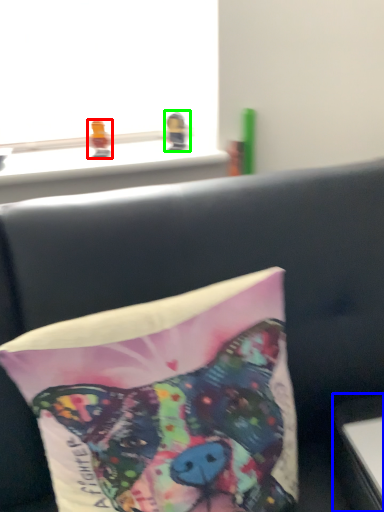
Question: Considering the real-world distances, which object is farthest from toy (highlighted by a red box)? table (highlighted by a blue box) or toy (highlighted by a green box)?

Choices:
 (A) table
 (B) toy

Answer: (A)